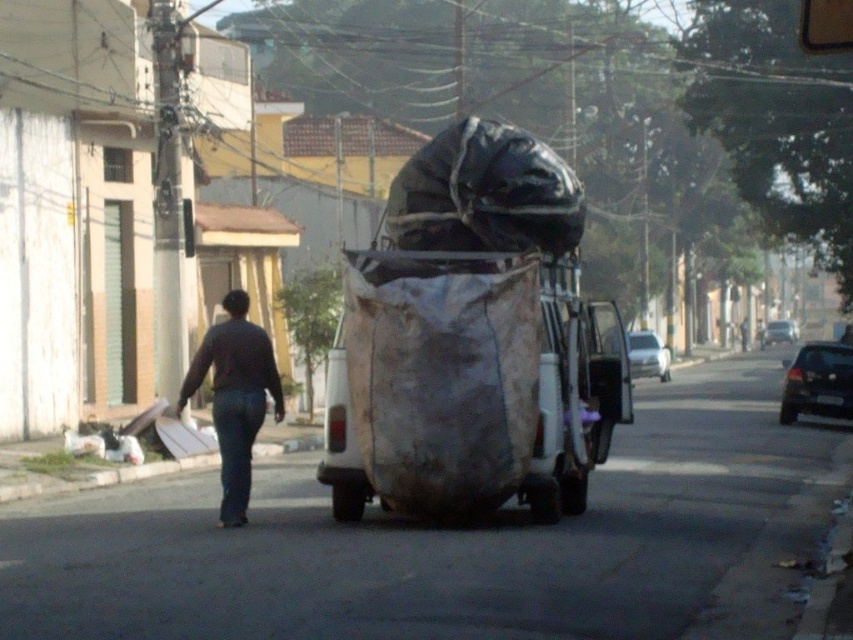
You are a pedestrian standing on the sidewalk and want to cross the street. There is a white glossy car at center and a shiny silver sedan at center in your path. Which vehicle should you avoid first to safely cross the street?

You should avoid the white glossy car at center first because it is closer to you than the shiny silver sedan at center.

You are a delivery driver who needs to unload a package from your truck. You see the gray concrete curb at lower left and the shiny silver sedan at center in your view. Which object is shorter in height?

The gray concrete curb at lower left is not as tall as the shiny silver sedan at center, so the gray concrete curb at lower left is shorter in height.